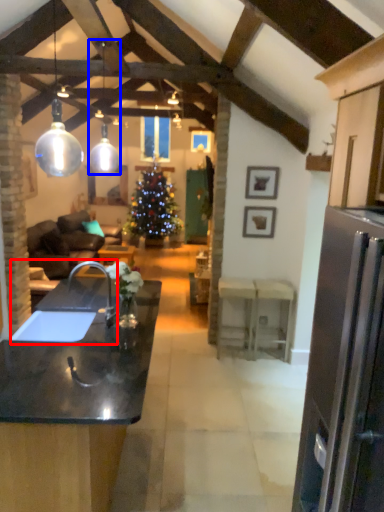
Question: Among these objects, which one is nearest to the camera, sink (highlighted by a red box) or lamp (highlighted by a blue box)?

Choices:
 (A) sink
 (B) lamp

Answer: (A)